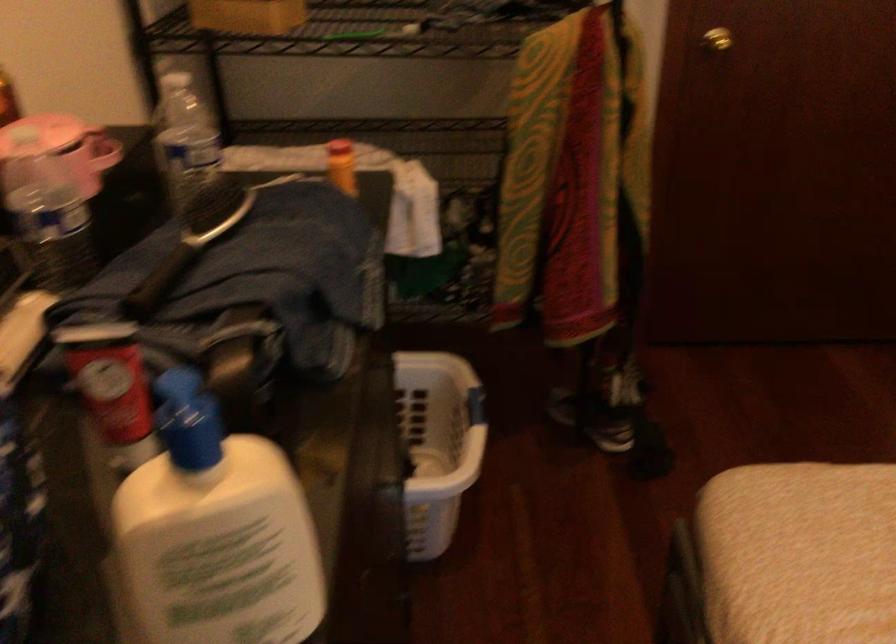
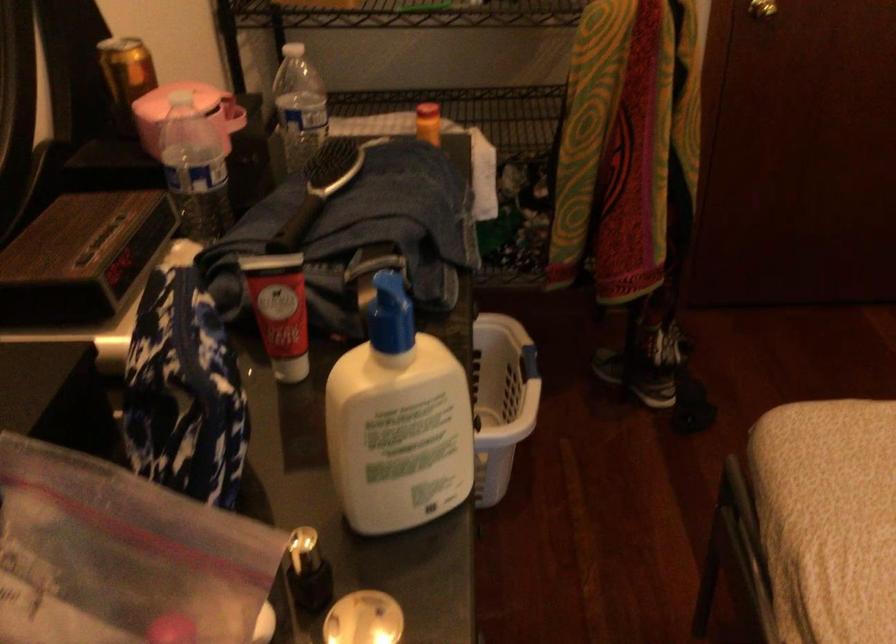
Where in the second image is the point corresponding to point (774, 563) from the first image?

(828, 488)